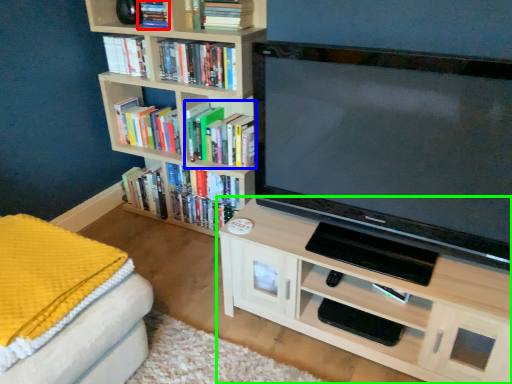
Question: Estimate the real-world distances between objects in this image. Which object is closer to book (highlighted by a red box), book (highlighted by a blue box) or shelf (highlighted by a green box)?

Choices:
 (A) book
 (B) shelf

Answer: (A)